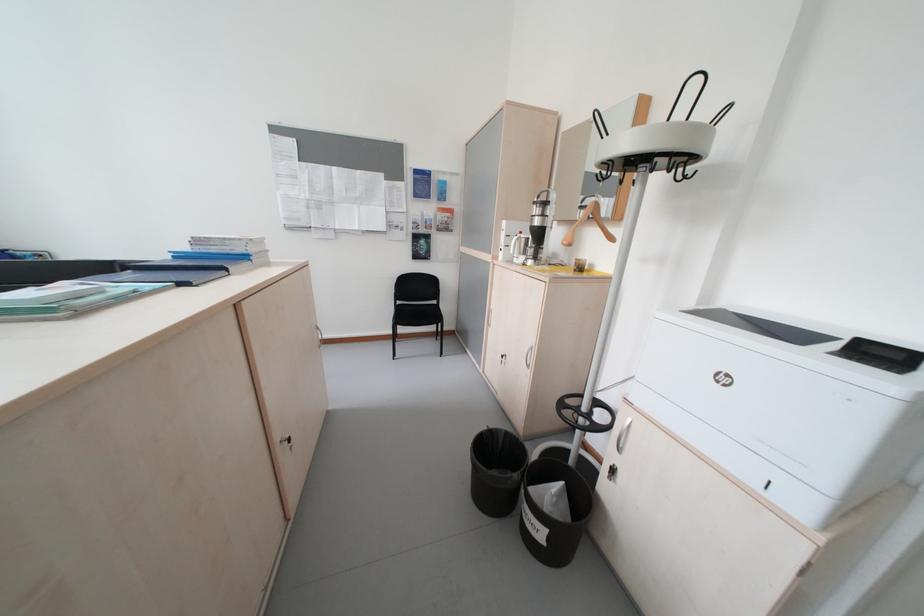
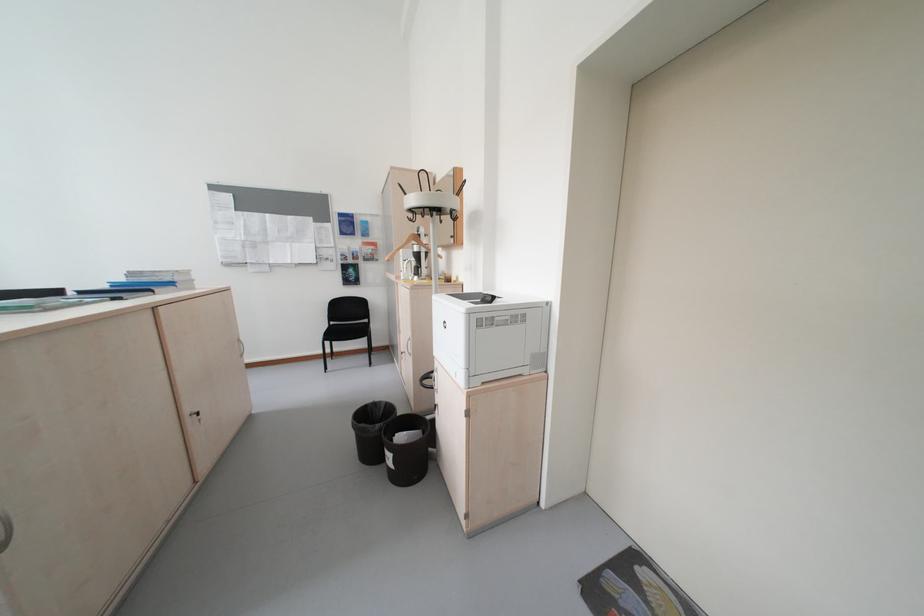
Locate, in the second image, the point that corresponds to (507,432) in the first image.

(391, 403)